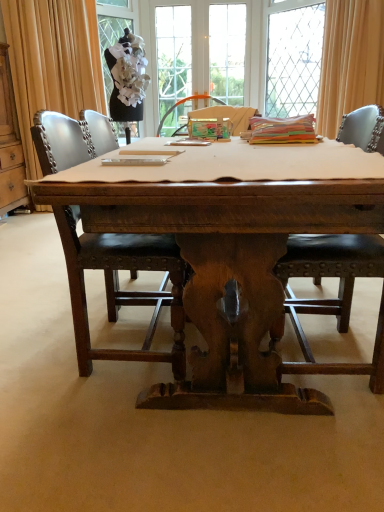
Question: Would you say clear glass window at upper center, which is the second window in right-to-left order, is to the left or to the right of beige fabric curtain at upper right, arranged as the first curtain when viewed from the right, in the picture?

Choices:
 (A) left
 (B) right

Answer: (A)

Question: Based on their sizes in the image, would you say clear glass window at upper center, which is the second window in right-to-left order, is bigger or smaller than beige fabric curtain at upper right, arranged as the first curtain when viewed from the right?

Choices:
 (A) big
 (B) small

Answer: (B)

Question: Which of these objects is positioned closest to the clear glass window at upper center, which is the second window in right-to-left order?

Choices:
 (A) beige fabric curtain at upper right, which is the 2th curtain from left to right
 (B) clear glass window at upper center, which ranks as the first window in right-to-left order
 (C) brown leather chair at center, acting as the first chair starting from the left
 (D) black fabric mannequin at upper left, the third window in the right-to-left sequence
 (E) beige fabric curtain at upper left, which is the 1th curtain in left-to-right order

Answer: (D)

Question: Considering the real-world distances, which object is closest to the wooden cabinet at left?

Choices:
 (A) beige fabric curtain at upper left, which is the 1th curtain in left-to-right order
 (B) brown leather chair at center, marked as the 2th chair in a right-to-left arrangement
 (C) clear glass window at upper center, which is the second window in right-to-left order
 (D) black fabric mannequin at upper left, the third window in the right-to-left sequence
 (E) black leather chair at center, the second chair in the left-to-right sequence

Answer: (A)